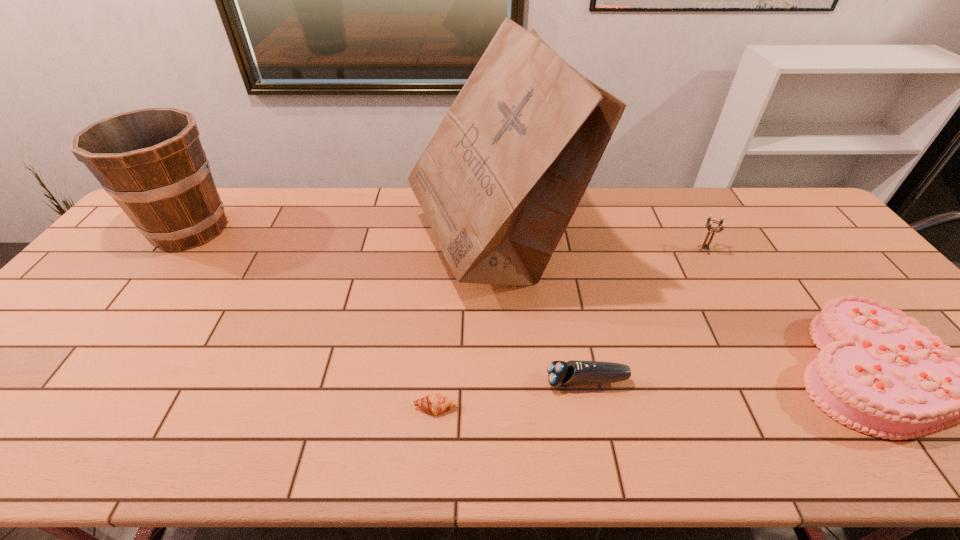
Find the location of a particular element. This screenshot has width=960, height=540. grocery bag is located at coordinates (501, 178).

What are the coordinates of `bucket` in the screenshot? It's located at (151, 161).

The image size is (960, 540). What are the coordinates of `the second tallest object` in the screenshot? It's located at (151, 161).

The width and height of the screenshot is (960, 540). In order to click on the fourth shortest object in this screenshot , I will do `click(709, 222)`.

I want to click on the fifth object from left to right, so click(709, 222).

What are the coordinates of `the second shortest object` in the screenshot? It's located at (560, 373).

Where is `the shortest object`? Image resolution: width=960 pixels, height=540 pixels. the shortest object is located at coordinates (435, 403).

The height and width of the screenshot is (540, 960). I want to click on free spot located 0.200m on the front of the grocery bag, so click(496, 373).

At what (x,y) coordinates should I click in order to perform the action: click on vacant space situated 0.270m on the front of the leftmost object. Please return your answer as a coordinate pair (x, y). Looking at the image, I should click on (113, 330).

Find the location of a particular element. The width and height of the screenshot is (960, 540). free space located on the left of the candle holder is located at coordinates (573, 250).